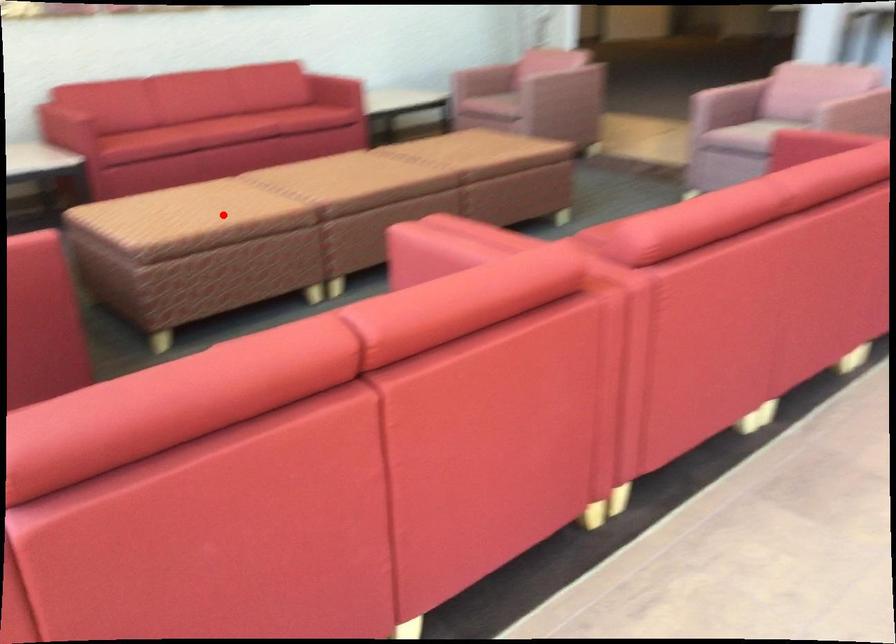
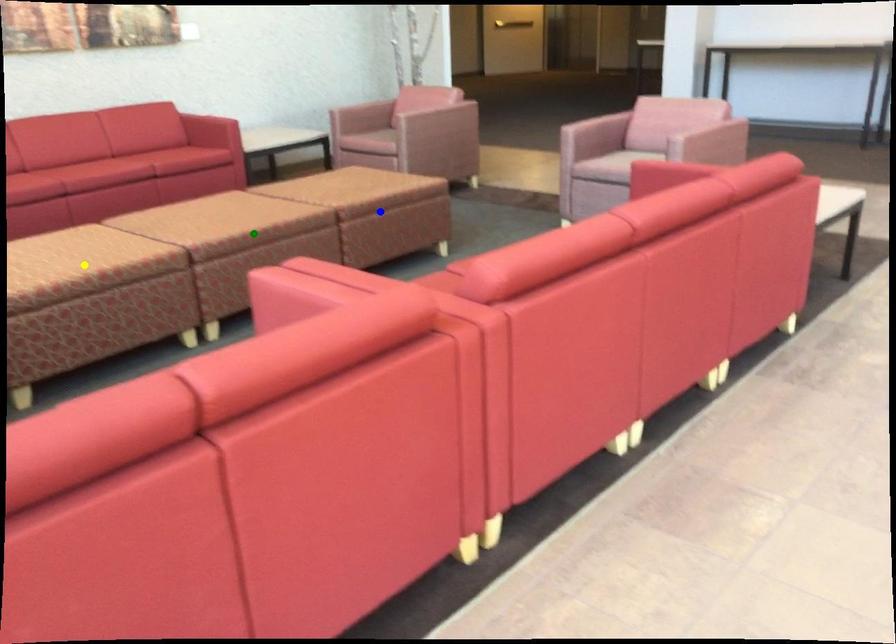
Question: I am providing you with two images of the same scene from different viewpoints. A red point is marked on the first image. You are given multiple points on the second image. Which mark in image 2 goes with the point in image 1?

Choices:
 (A) yellow point
 (B) blue point
 (C) green point

Answer: (A)